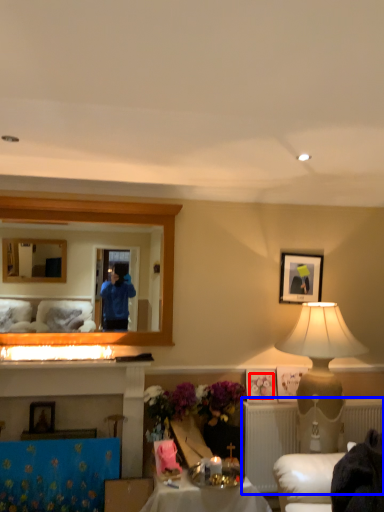
Question: Which of the following is the closest to the observer, flower (highlighted by a red box) or radiator (highlighted by a blue box)?

Choices:
 (A) flower
 (B) radiator

Answer: (B)